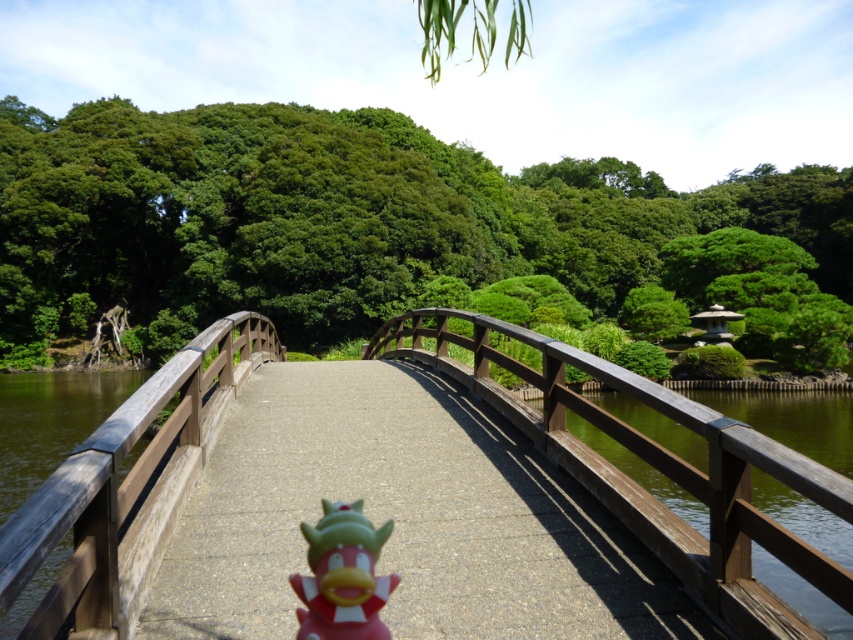
You are a painter standing at the bottom center of the image. You want to paint the wooden bridge at center and the wooden rail at center. Which object will require you to use more paint to cover its entire visible area?

The wooden rail at center requires more paint because it occupies more space than the wooden bridge at center.

You are a photographer trying to capture the wooden bridge at center and the pink rubber duck at center in the same frame. Considering their heights, which object will appear larger in your photo?

The wooden bridge at center has a greater height compared to the pink rubber duck at center, so it will appear larger in the photo.

You are standing on the wooden bridge at center and looking towards the wooden rail at center. Which object is closer to you?

The wooden rail at center is behind the wooden bridge at center, so the wooden bridge at center is closer to you.